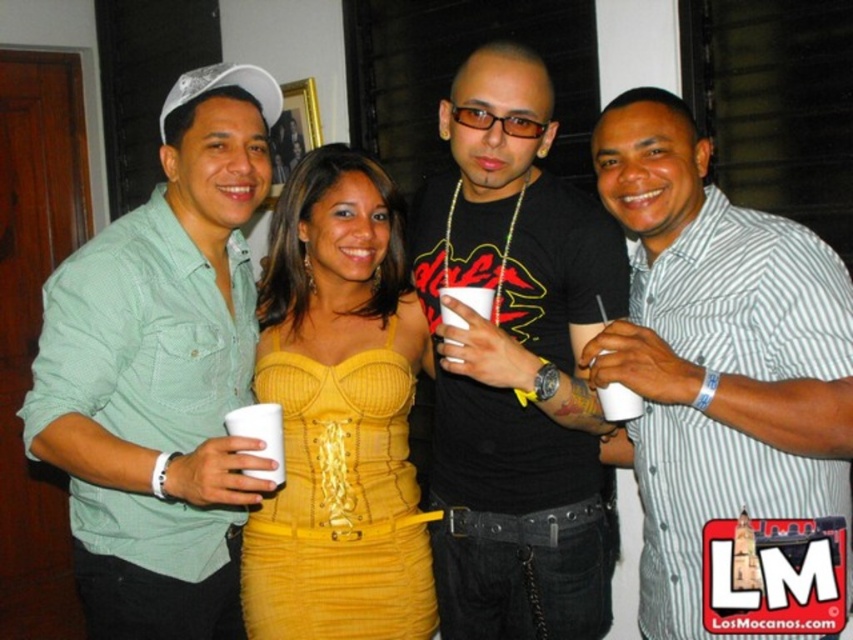
Is green cotton shirt at left smaller than yellow ribbed fabric dress at center?

No, green cotton shirt at left is not smaller than yellow ribbed fabric dress at center.

Which is below, green cotton shirt at left or yellow ribbed fabric dress at center?

yellow ribbed fabric dress at center is below.

Is point (161, 481) less distant than point (334, 512)?

Yes, it is in front of point (334, 512).

Find the location of a particular element. This screenshot has height=640, width=853. green cotton shirt at left is located at coordinates (161, 372).

Is green cotton shirt at left to the left of white plastic cup at lower left from the viewer's perspective?

Correct, you'll find green cotton shirt at left to the left of white plastic cup at lower left.

Is point (170, 593) in front of point (250, 436)?

No, (170, 593) is further to viewer.

The width and height of the screenshot is (853, 640). I want to click on green cotton shirt at left, so click(x=161, y=372).

Is white striped shirt at center taller than white paper cup at right?

Yes.

Locate an element on the screen. Image resolution: width=853 pixels, height=640 pixels. white striped shirt at center is located at coordinates (717, 356).